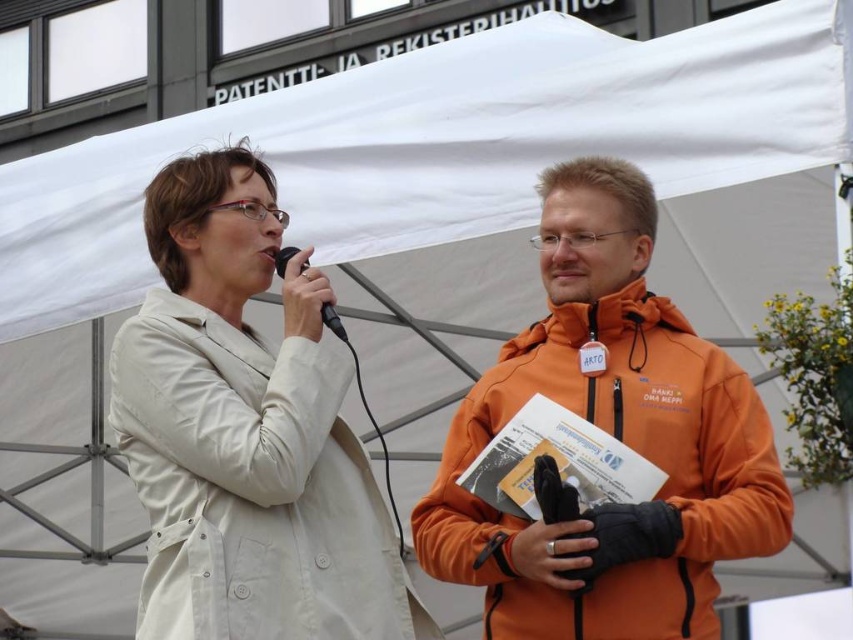
Question: Which of these objects is positioned closest to the black plastic microphone at center?

Choices:
 (A) orange fleece jacket at right
 (B) matte white coat at left

Answer: (B)

Question: Considering the relative positions of matte white coat at left and black plastic microphone at center in the image provided, where is matte white coat at left located with respect to black plastic microphone at center?

Choices:
 (A) above
 (B) below

Answer: (B)

Question: Does matte white coat at left have a lesser width compared to black plastic microphone at center?

Choices:
 (A) yes
 (B) no

Answer: (B)

Question: Which of the following is the closest to the observer?

Choices:
 (A) (289, 257)
 (B) (614, 266)

Answer: (A)

Question: Is matte white coat at left bigger than black plastic microphone at center?

Choices:
 (A) no
 (B) yes

Answer: (B)

Question: Among these points, which one is farthest from the camera?

Choices:
 (A) (167, 573)
 (B) (607, 168)

Answer: (B)